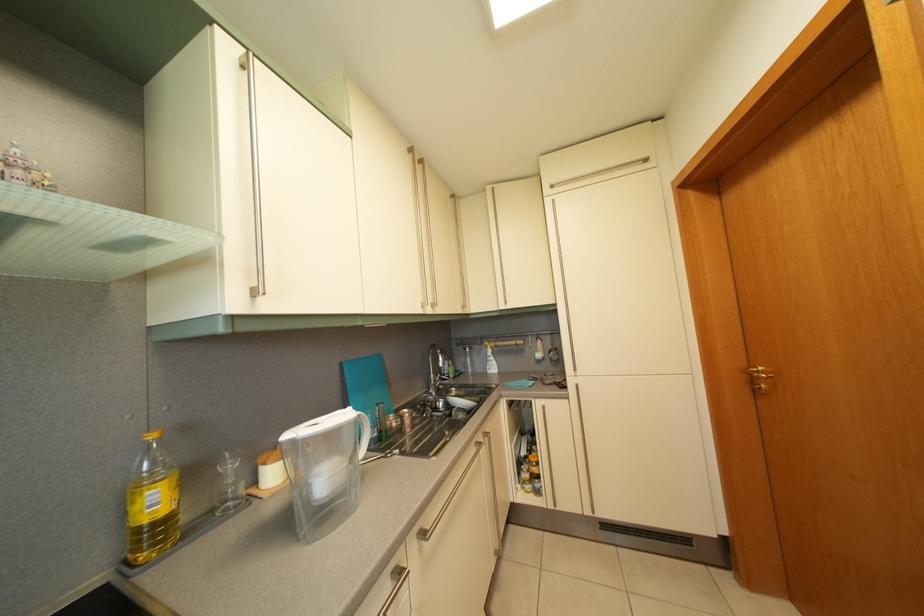
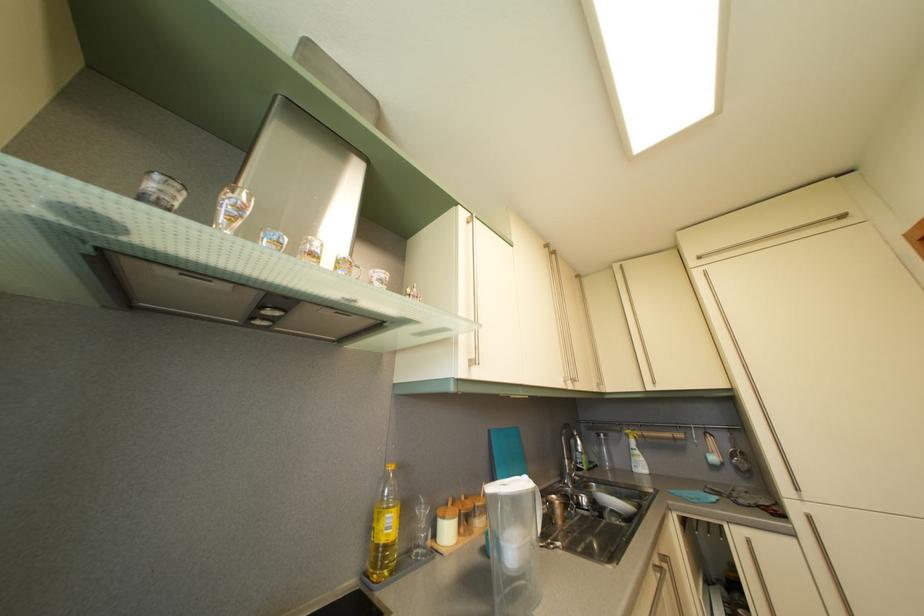
The point at (270, 467) is marked in the first image. Where is the corresponding point in the second image?

(448, 519)